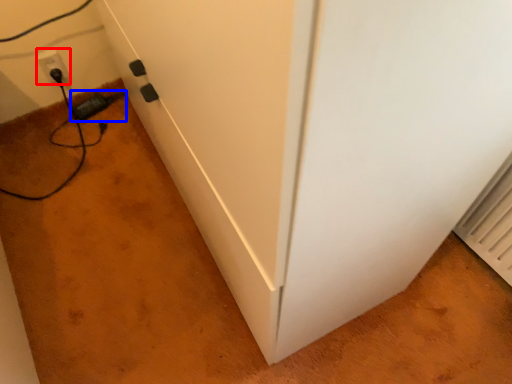
Question: Which point is closer to the camera, electric outlet (highlighted by a red box) or plug (highlighted by a blue box)?

Choices:
 (A) electric outlet
 (B) plug

Answer: (A)